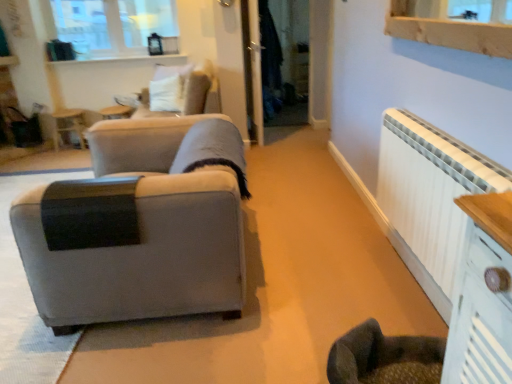
Question: Is wooden side table at upper left oriented away from white glossy ledge at upper center?

Choices:
 (A) no
 (B) yes

Answer: (A)

Question: Are wooden side table at upper left and white glossy ledge at upper center located far from each other?

Choices:
 (A) yes
 (B) no

Answer: (B)

Question: Could you tell me if wooden side table at upper left is turned towards white glossy ledge at upper center?

Choices:
 (A) no
 (B) yes

Answer: (A)

Question: From a real-world perspective, is wooden side table at upper left over white glossy ledge at upper center?

Choices:
 (A) yes
 (B) no

Answer: (B)

Question: Does wooden side table at upper left have a smaller size compared to white glossy ledge at upper center?

Choices:
 (A) yes
 (B) no

Answer: (B)

Question: Can you confirm if wooden side table at upper left is taller than white glossy ledge at upper center?

Choices:
 (A) no
 (B) yes

Answer: (B)

Question: Does clear glass window at upper left turn towards transparent glass door at center?

Choices:
 (A) no
 (B) yes

Answer: (A)

Question: Can you confirm if clear glass window at upper left is shorter than transparent glass door at center?

Choices:
 (A) yes
 (B) no

Answer: (A)

Question: Does clear glass window at upper left come behind transparent glass door at center?

Choices:
 (A) no
 (B) yes

Answer: (A)

Question: From the image's perspective, would you say clear glass window at upper left is shown under transparent glass door at center?

Choices:
 (A) yes
 (B) no

Answer: (B)

Question: Can you confirm if clear glass window at upper left is positioned to the right of transparent glass door at center?

Choices:
 (A) yes
 (B) no

Answer: (B)

Question: Can you confirm if clear glass window at upper left is wider than transparent glass door at center?

Choices:
 (A) yes
 (B) no

Answer: (B)

Question: Is matte gray fabric couch at left located outside clear glass window at upper left?

Choices:
 (A) no
 (B) yes

Answer: (B)